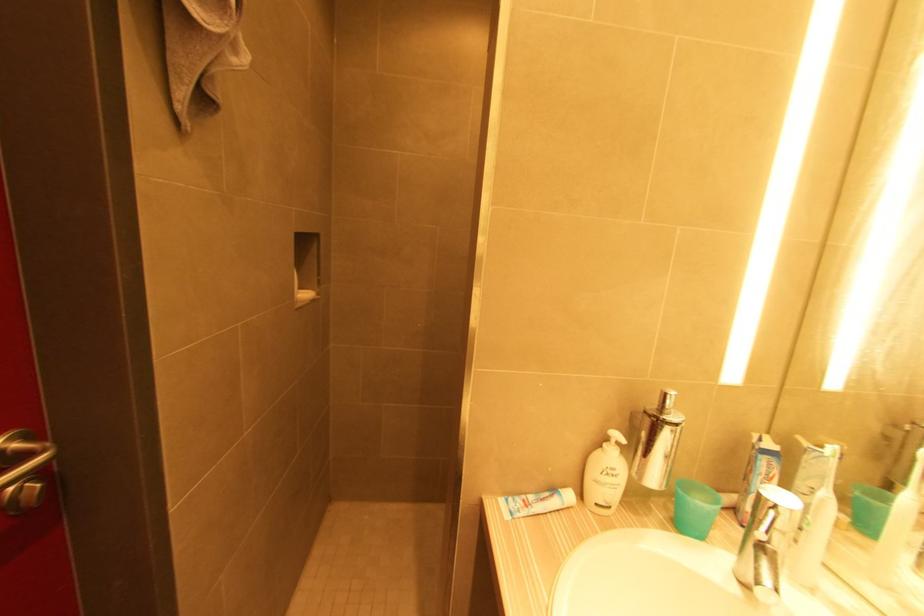
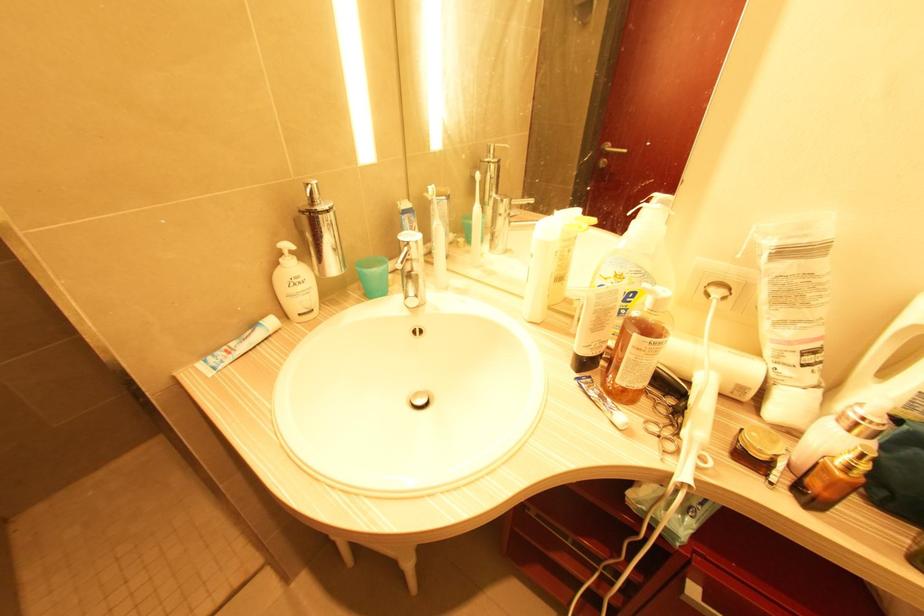
The point at (681, 492) is marked in the first image. Where is the corresponding point in the second image?

(359, 270)